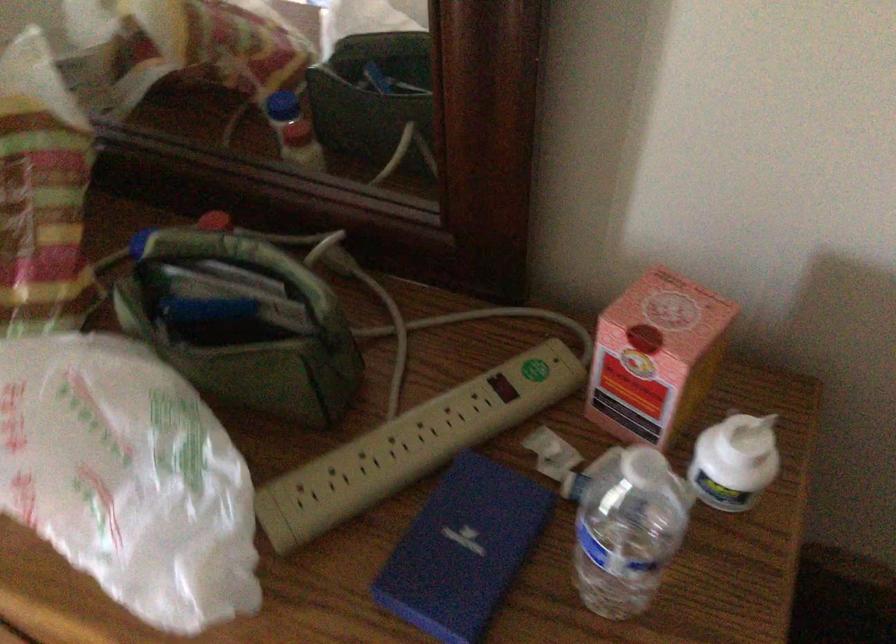
Describe the element at coordinates (503, 386) in the screenshot. I see `the power strip switch` at that location.